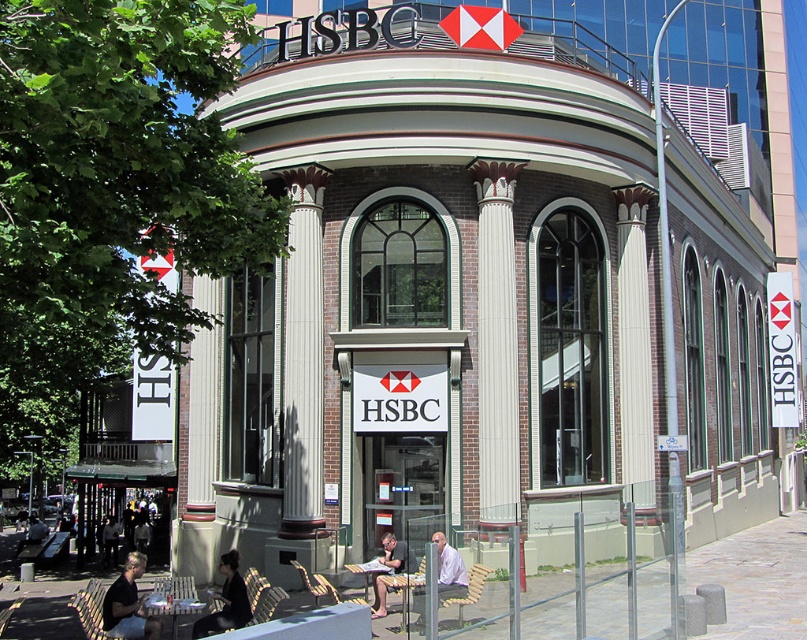
Question: Can you confirm if white marble column at center is smaller than black fabric chair at lower left?

Choices:
 (A) no
 (B) yes

Answer: (B)

Question: Does black fabric chair at lower left have a greater width compared to light brown wooden bench at center?

Choices:
 (A) no
 (B) yes

Answer: (B)

Question: Which object is farther from the camera taking this photo?

Choices:
 (A) light brown wooden bench at center
 (B) black fabric chair at lower left
 (C) black shirt at lower left
 (D) white textured column at center

Answer: (D)

Question: Is white marble column at center closer to camera compared to white textured column at center?

Choices:
 (A) no
 (B) yes

Answer: (B)

Question: Which point is farther from the camera taking this photo?

Choices:
 (A) (400, 556)
 (B) (516, 172)

Answer: (B)

Question: Among these points, which one is nearest to the camera?

Choices:
 (A) (633, 202)
 (B) (19, 545)
 (C) (105, 604)

Answer: (C)